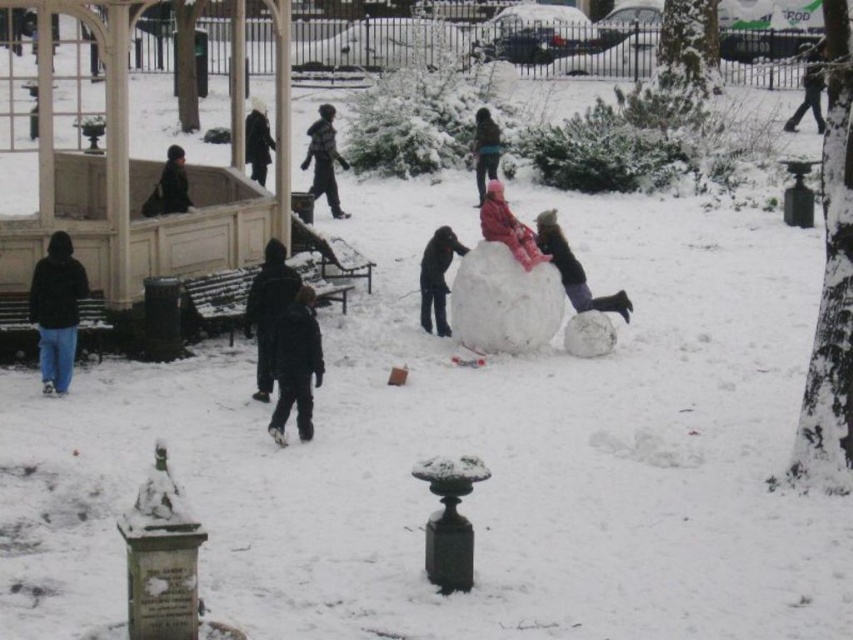
Based on the photo, does black matte jacket at center appear on the left side of black matte coat at upper center?

No, black matte jacket at center is not to the left of black matte coat at upper center.

Is black matte jacket at center to the right of black matte coat at upper center from the viewer's perspective?

Yes, black matte jacket at center is to the right of black matte coat at upper center.

This screenshot has width=853, height=640. I want to click on black matte jacket at center, so click(x=268, y=310).

The height and width of the screenshot is (640, 853). What are the coordinates of `black matte jacket at center` in the screenshot? It's located at (268, 310).

Is pink fabric snowman at center to the left of dark gray sweater at center from the viewer's perspective?

In fact, pink fabric snowman at center is to the right of dark gray sweater at center.

Between pink fabric snowman at center and dark gray sweater at center, which one is positioned higher?

dark gray sweater at center

Does point (521, 240) lie in front of point (328, 193)?

That is True.

Image resolution: width=853 pixels, height=640 pixels. Identify the location of pink fabric snowman at center. (508, 227).

Is black matte snowball at center closer to camera compared to dark brown jacket at upper left?

That is True.

Is black matte snowball at center above dark brown jacket at upper left?

Incorrect, black matte snowball at center is not positioned above dark brown jacket at upper left.

Who is more forward, (427, 332) or (173, 147)?

Point (427, 332) is in front.

At what (x,y) coordinates should I click in order to perform the action: click on black matte snowball at center. Please return your answer as a coordinate pair (x, y). This screenshot has height=640, width=853. Looking at the image, I should click on (437, 276).